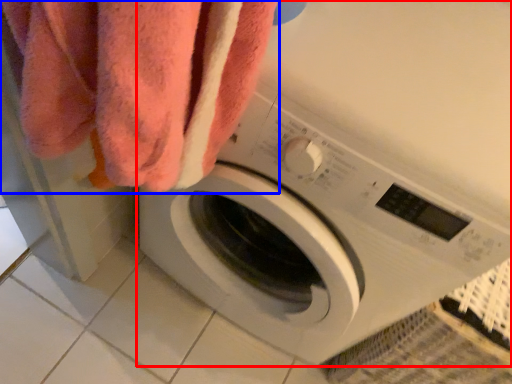
Question: Which object appears closest to the camera in this image, washing machine (highlighted by a red box) or towel (highlighted by a blue box)?

Choices:
 (A) washing machine
 (B) towel

Answer: (A)